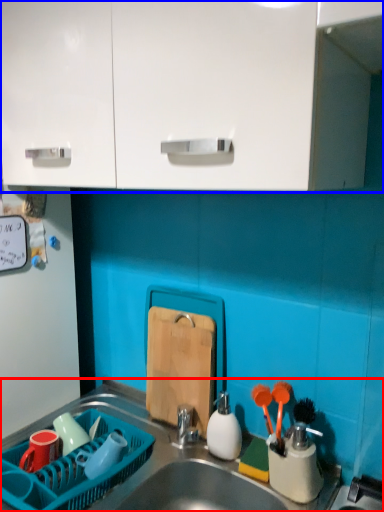
Question: Which of the following is the closest to the observer, sink (highlighted by a red box) or cabinetry (highlighted by a blue box)?

Choices:
 (A) sink
 (B) cabinetry

Answer: (B)